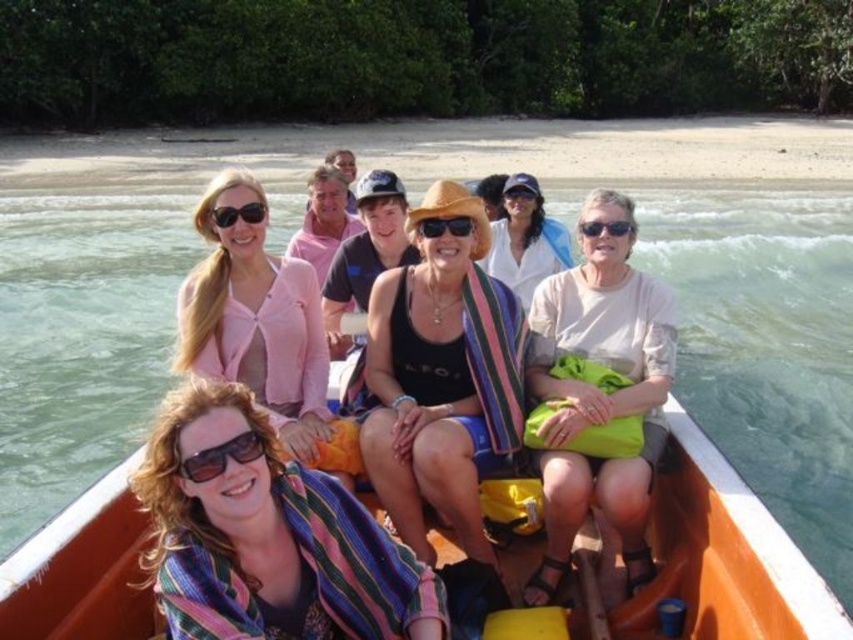
Question: Among these objects, which one is nearest to the camera?

Choices:
 (A) sunglasses at center
 (B) matte black tank top at center

Answer: (A)

Question: Which point is closer to the camera?

Choices:
 (A) (234, 212)
 (B) (583, 230)

Answer: (B)

Question: Can you confirm if sunglasses at center is bigger than matte black sunglasses at upper left?

Choices:
 (A) no
 (B) yes

Answer: (B)

Question: Is matte black sunglasses at center to the right of black plastic goggles at center from the viewer's perspective?

Choices:
 (A) yes
 (B) no

Answer: (B)

Question: Where is white cotton shirt at center located in relation to sunglasses at center in the image?

Choices:
 (A) below
 (B) above

Answer: (B)

Question: Which point is closer to the camera?

Choices:
 (A) (263, 449)
 (B) (212, 252)
 (C) (585, 221)
 (D) (416, 230)

Answer: (A)